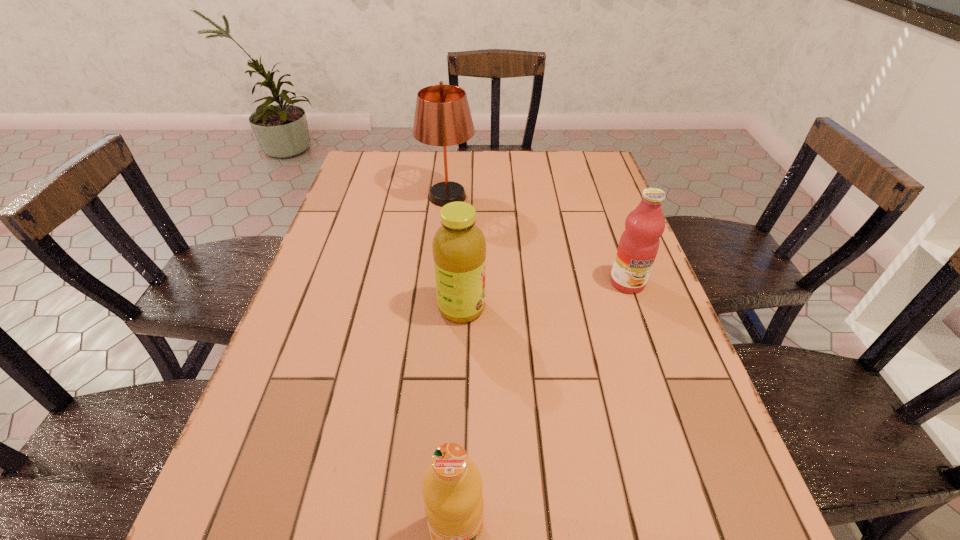
Find the location of `free region at the far left corner of the desktop`. free region at the far left corner of the desktop is located at coordinates (390, 159).

In the image, there is a desktop. In order to click on vacant space at the near left corner in this screenshot , I will do `click(293, 533)`.

Image resolution: width=960 pixels, height=540 pixels. In order to click on vacant space at the far right corner in this screenshot , I will do `click(569, 166)`.

You are a GUI agent. You are given a task and a screenshot of the screen. Output one action in this format:
    pyautogui.click(x=<x>, y=<y>)
    Task: Click on the vacant space that is in between the rightmost object and the lampshade
    
    Given the screenshot: What is the action you would take?
    pyautogui.click(x=538, y=240)

Identify the location of vacant space in between the rightmost fruit juice and the lampshade. The width and height of the screenshot is (960, 540). (538, 240).

Choose which object is the third nearest neighbor to the nearest object. Please provide its 2D coordinates. Your answer should be formatted as a tuple, i.e. [(x, y)], where the tuple contains the x and y coordinates of a point satisfying the conditions above.

[(442, 117)]

Choose which object is the nearest neighbor to the nearest object. Please provide its 2D coordinates. Your answer should be formatted as a tuple, i.e. [(x, y)], where the tuple contains the x and y coordinates of a point satisfying the conditions above.

[(459, 248)]

Select which fruit juice is the third closest to the lampshade. Please provide its 2D coordinates. Your answer should be formatted as a tuple, i.e. [(x, y)], where the tuple contains the x and y coordinates of a point satisfying the conditions above.

[(452, 486)]

What are the coordinates of `fruit juice that is the third closest to the farthest object` in the screenshot? It's located at (452, 486).